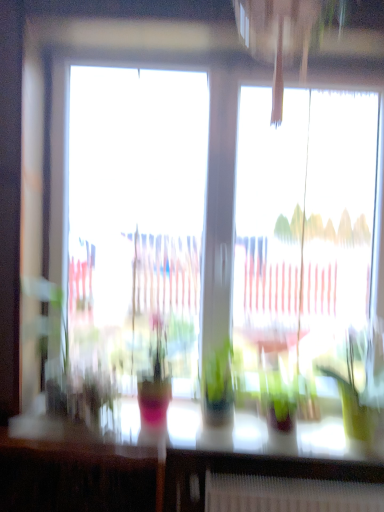
Question: Considering the positions of transparent glass window at center and green glossy houseplant at right in the image, is transparent glass window at center taller or shorter than green glossy houseplant at right?

Choices:
 (A) tall
 (B) short

Answer: (A)

Question: From a real-world perspective, is transparent glass window at center positioned above or below green glossy houseplant at right?

Choices:
 (A) below
 (B) above

Answer: (B)

Question: Which object is positioned farthest from the translucent glass table at lower center?

Choices:
 (A) green glossy houseplant at right
 (B) transparent glass window at center

Answer: (B)

Question: Which object is the farthest from the translucent glass table at lower center?

Choices:
 (A) green glossy houseplant at right
 (B) transparent glass window at center

Answer: (B)